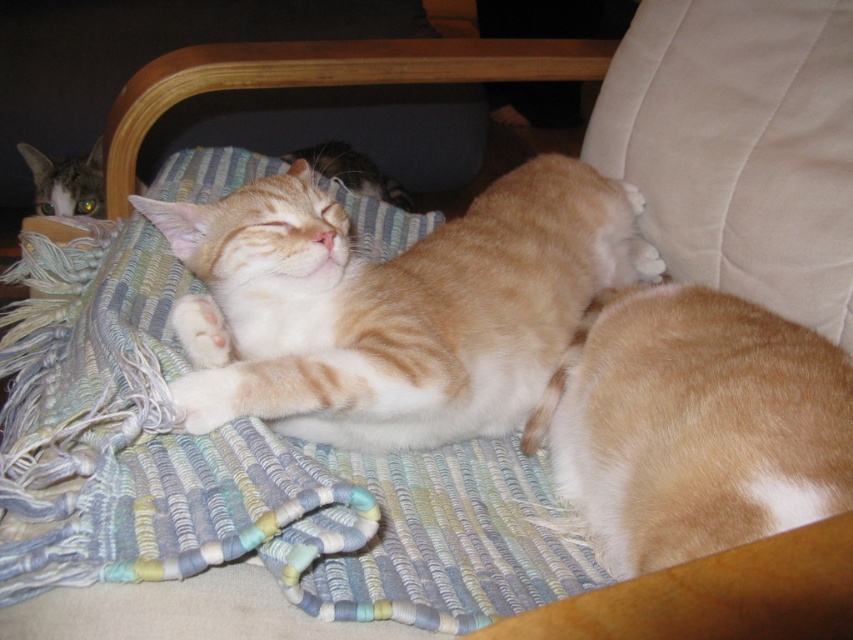
From the picture: Is golden fur cat at center behind orange fur cat at center?

No, golden fur cat at center is closer to the viewer.

Who is more distant from viewer, [666,300] or [369,188]?

Point [369,188]

Which is in front, point (691, 304) or point (339, 170)?

Point (691, 304) is more forward.

Identify the location of golden fur cat at center. (694, 426).

Is point (344, 227) farther from viewer compared to point (42, 205)?

No, (344, 227) is closer to viewer.

Can you confirm if orange tabby cat at center is shorter than tabby fur cat at upper left?

No, orange tabby cat at center is not shorter than tabby fur cat at upper left.

The width and height of the screenshot is (853, 640). What do you see at coordinates (392, 305) in the screenshot? I see `orange tabby cat at center` at bounding box center [392, 305].

This screenshot has height=640, width=853. I want to click on orange tabby cat at center, so click(x=392, y=305).

Is tabby fur cat at upper left above orange fur cat at center?

No, tabby fur cat at upper left is not above orange fur cat at center.

Where is `tabby fur cat at upper left`? tabby fur cat at upper left is located at coordinates (67, 180).

The image size is (853, 640). Identify the location of tabby fur cat at upper left. (67, 180).